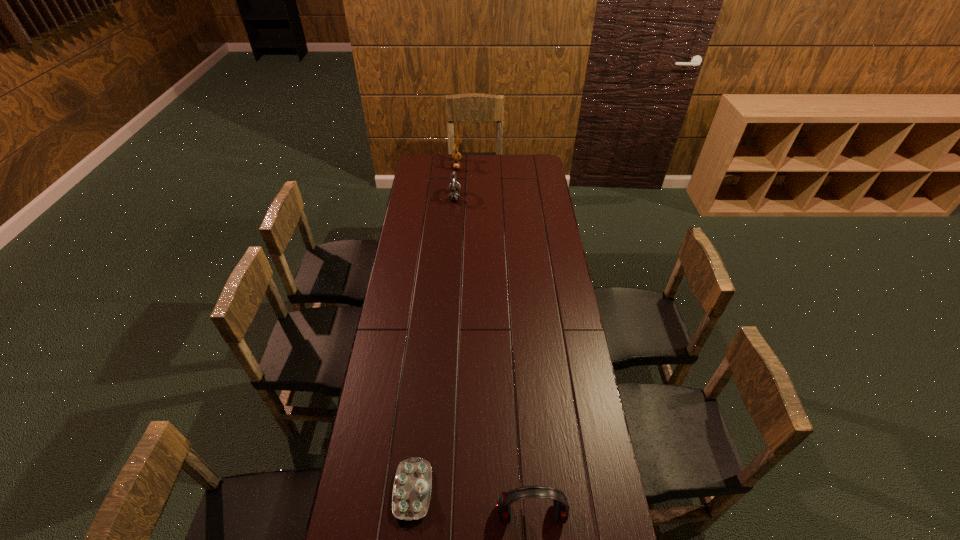
Locate an element on the screen. the farthest object is located at coordinates (456, 165).

I want to click on the third nearest object, so click(x=454, y=188).

Find the location of a particular element. the rightmost earphone is located at coordinates (561, 506).

The height and width of the screenshot is (540, 960). I want to click on the rightmost object, so click(561, 506).

The image size is (960, 540). Find the location of `the shortest object`. the shortest object is located at coordinates (412, 486).

What are the coordinates of `vacant region located 0.080m on the front-facing side of the farthest earphone` in the screenshot? It's located at (475, 165).

I want to click on free space located 0.180m on the ear pads of the second farthest object, so click(x=492, y=197).

The width and height of the screenshot is (960, 540). I want to click on vacant space located on the back of the shortest object, so click(x=426, y=358).

Find the location of a particular element. This screenshot has width=960, height=540. object located in the far edge section of the desktop is located at coordinates (456, 165).

Locate an element on the screen. The image size is (960, 540). object at the left edge is located at coordinates (412, 486).